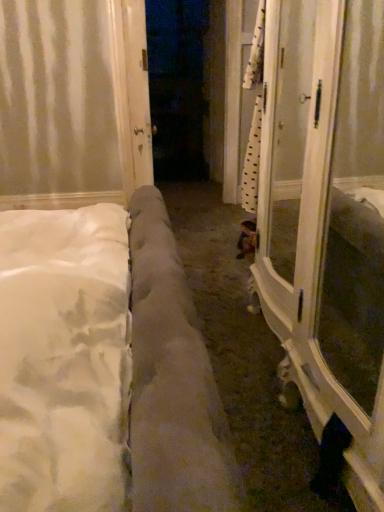
Locate an element on the screen. The width and height of the screenshot is (384, 512). white glossy door at center is located at coordinates (138, 90).

Describe the element at coordinates (138, 90) in the screenshot. I see `white glossy door at center` at that location.

The height and width of the screenshot is (512, 384). Describe the element at coordinates (297, 156) in the screenshot. I see `white glossy screen door at right` at that location.

In order to face white glossy screen door at right, should I rotate leftwards or rightwards?

Rotate right and turn 14.213 degrees.

What is the approximate width of white glossy screen door at right?

It is 11.80 inches.

Image resolution: width=384 pixels, height=512 pixels. What are the coordinates of `white glossy screen door at right` in the screenshot? It's located at (297, 156).

Where is `white glossy door at center`? white glossy door at center is located at coordinates (138, 90).

Considering the relative positions of white glossy screen door at right and white glossy door at center in the image provided, is white glossy screen door at right to the left of white glossy door at center from the viewer's perspective?

No, white glossy screen door at right is not to the left of white glossy door at center.

Which object is further away from the camera, white glossy screen door at right or white glossy door at center?

white glossy door at center is further from the camera.

Is point (278, 154) behind point (138, 94)?

Yes, it is behind point (138, 94).

From the image's perspective, is white glossy screen door at right positioned above or below white glossy door at center?

Clearly, from the image's perspective, white glossy screen door at right is below white glossy door at center.

From a real-world perspective, is white glossy screen door at right physically located above or below white glossy door at center?

white glossy screen door at right is situated lower than white glossy door at center in the real world.

Which of these two, white glossy screen door at right or white glossy door at center, is wider?

white glossy screen door at right is wider.

Is white glossy screen door at right taller or shorter than white glossy door at center?

white glossy screen door at right is shorter than white glossy door at center.

Between white glossy screen door at right and white glossy door at center, which one has smaller size?

Smaller between the two is white glossy door at center.

In the scene shown: Would you say white glossy door at center is part of white glossy screen door at right's contents?

No.

Is white glossy screen door at right next to white glossy door at center?

No, white glossy screen door at right is not with white glossy door at center.

Consider the image. Is white glossy screen door at right facing towards white glossy door at center?

No, white glossy screen door at right is not facing towards white glossy door at center.

Where is `door lying above the white glossy screen door at right (from the image's perspective)`? This screenshot has height=512, width=384. door lying above the white glossy screen door at right (from the image's perspective) is located at coordinates (138, 90).

Between white glossy door at center and white glossy screen door at right, which one appears on the left side from the viewer's perspective?

Positioned to the left is white glossy door at center.

Between white glossy door at center and white glossy screen door at right, which one is positioned in front?

white glossy screen door at right.

Which is in front, point (142, 31) or point (312, 250)?

The point (312, 250) is more forward.

From the image's perspective, is white glossy door at center positioned above or below white glossy screen door at right?

white glossy door at center is situated higher than white glossy screen door at right in the image.

From a real-world perspective, is white glossy door at center over white glossy screen door at right?

Yes, from a real-world perspective, white glossy door at center is above white glossy screen door at right.

Does white glossy door at center have a greater width compared to white glossy screen door at right?

No, white glossy door at center is not wider than white glossy screen door at right.

Considering the relative sizes of white glossy door at center and white glossy screen door at right in the image provided, is white glossy door at center taller than white glossy screen door at right?

Indeed, white glossy door at center has a greater height compared to white glossy screen door at right.

Considering the relative sizes of white glossy door at center and white glossy screen door at right in the image provided, is white glossy door at center smaller than white glossy screen door at right?

Yes, white glossy door at center is smaller than white glossy screen door at right.

Would you say white glossy door at center is outside white glossy screen door at right?

Absolutely, white glossy door at center is external to white glossy screen door at right.

In the scene shown: Is white glossy door at center touching white glossy screen door at right?

white glossy door at center is not next to white glossy screen door at right, and they're not touching.

Is white glossy screen door at right at the back of white glossy door at center?

No, white glossy door at center is not facing away from white glossy screen door at right.

At what (x,y) coordinates should I click in order to perform the action: click on door located behind the white glossy screen door at right. Please return your answer as a coordinate pair (x, y). The height and width of the screenshot is (512, 384). Looking at the image, I should click on (138, 90).

Find the location of a particular element. Image resolution: width=384 pixels, height=512 pixels. screen door located on the right of white glossy door at center is located at coordinates (297, 156).

Image resolution: width=384 pixels, height=512 pixels. In the image, there is a white glossy screen door at right. Find the location of `door above it (from the image's perspective)`. door above it (from the image's perspective) is located at coordinates (138, 90).